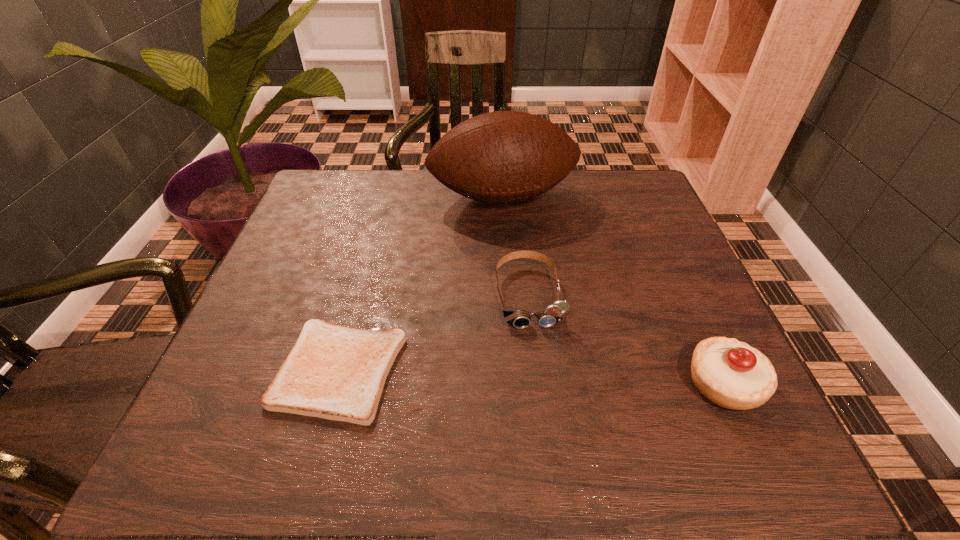
The image size is (960, 540). Find the location of `free space located on the laces of the tallest object`. free space located on the laces of the tallest object is located at coordinates (566, 353).

Where is `vacant space located 0.360m on the laces of the tallest object`? vacant space located 0.360m on the laces of the tallest object is located at coordinates (561, 336).

In order to click on object that is at the far edge in this screenshot , I will do `click(498, 157)`.

Image resolution: width=960 pixels, height=540 pixels. I want to click on toast located at the near edge, so click(x=338, y=373).

Find the location of a particular element. This screenshot has height=540, width=960. pastry present at the near edge is located at coordinates (731, 374).

This screenshot has height=540, width=960. I want to click on object located in the left edge section of the desktop, so click(338, 373).

At what (x,y) coordinates should I click in order to perform the action: click on object located at the right edge. Please return your answer as a coordinate pair (x, y). The height and width of the screenshot is (540, 960). Looking at the image, I should click on [x=731, y=374].

Image resolution: width=960 pixels, height=540 pixels. Identify the location of object located at the near left corner. (338, 373).

The width and height of the screenshot is (960, 540). Identify the location of object positioned at the near right corner. (731, 374).

At what (x,y) coordinates should I click in order to perform the action: click on vacant space at the far edge of the desktop. Please return your answer as a coordinate pair (x, y). Image resolution: width=960 pixels, height=540 pixels. Looking at the image, I should click on (553, 195).